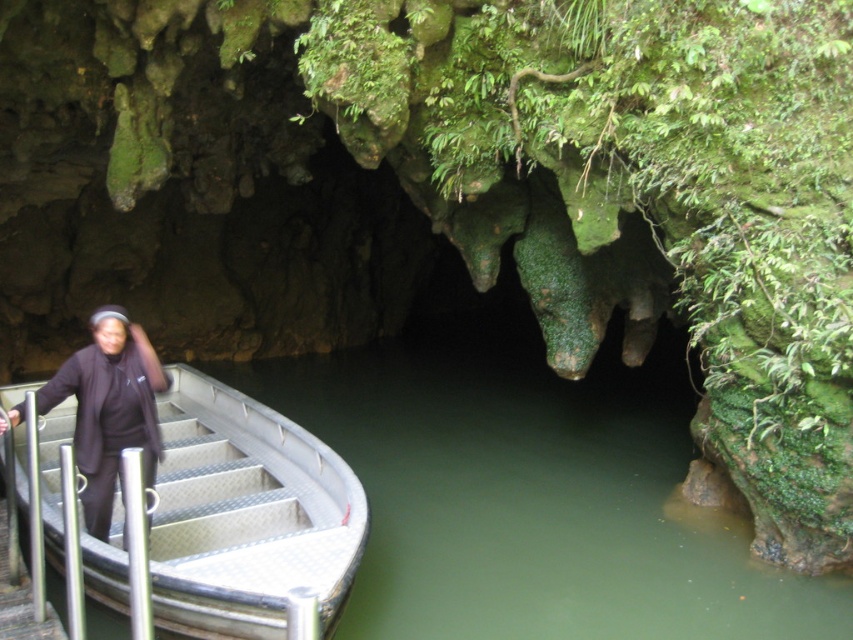
You are standing at the entrance of the cave and want to take a photo of the two points marked in the image. Which point, point (209,500) or point (96,525), will appear larger in your camera view?

Point (209,500) will appear larger in your camera view because it is closer to the camera compared to point (96,525).